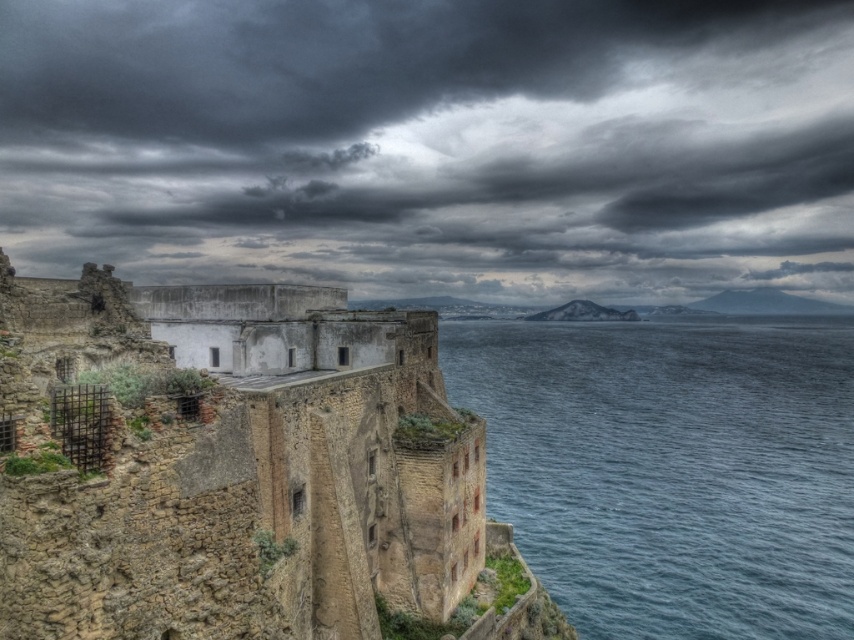
Is dark gray cloud at upper center taller than brown stone fort at center?

Correct, dark gray cloud at upper center is much taller as brown stone fort at center.

What do you see at coordinates (433, 145) in the screenshot? Image resolution: width=854 pixels, height=640 pixels. I see `dark gray cloud at upper center` at bounding box center [433, 145].

Does point (562, 182) come in front of point (373, 497)?

No, (562, 182) is further to viewer.

The width and height of the screenshot is (854, 640). I want to click on dark gray cloud at upper center, so click(433, 145).

Consider the image. Which of these two, dark gray cloud at upper center or blue water at lower right, stands shorter?

blue water at lower right is shorter.

Between dark gray cloud at upper center and blue water at lower right, which one has more height?

dark gray cloud at upper center

Between point (151, 129) and point (741, 637), which one is positioned behind?

Point (151, 129)

The height and width of the screenshot is (640, 854). I want to click on dark gray cloud at upper center, so click(433, 145).

Who is shorter, brown stone fort at center or blue water at lower right?

brown stone fort at center is shorter.

Does brown stone fort at center appear on the right side of blue water at lower right?

Incorrect, brown stone fort at center is not on the right side of blue water at lower right.

Does point (455, 572) come behind point (662, 524)?

No, it is not.

You are a GUI agent. You are given a task and a screenshot of the screen. Output one action in this format:
    pyautogui.click(x=<x>, y=<y>)
    Task: Click on the brown stone fort at center
    Image resolution: width=854 pixels, height=640 pixels.
    Given the screenshot: What is the action you would take?
    pyautogui.click(x=225, y=465)